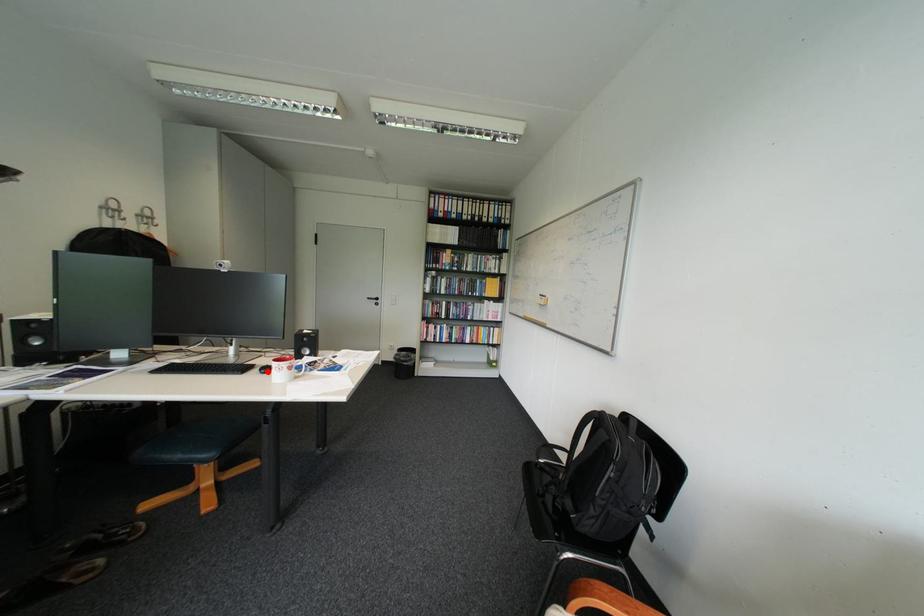
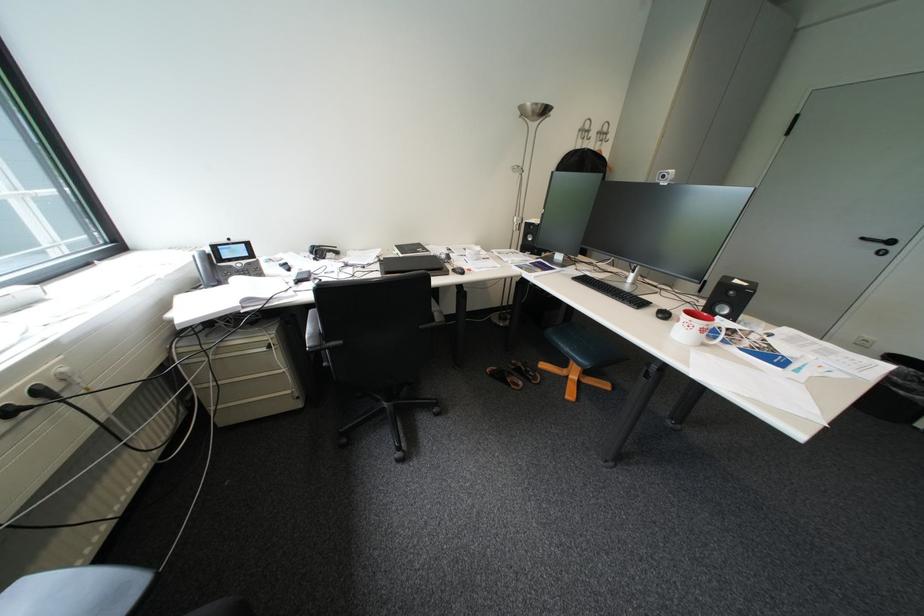
Question: I am providing you with two images of the same scene from different viewpoints. A red point is shown in image1. For the corresponding object point in image2, is it positioned nearer or farther from the camera?

Choices:
 (A) Nearer
 (B) Farther

Answer: (A)